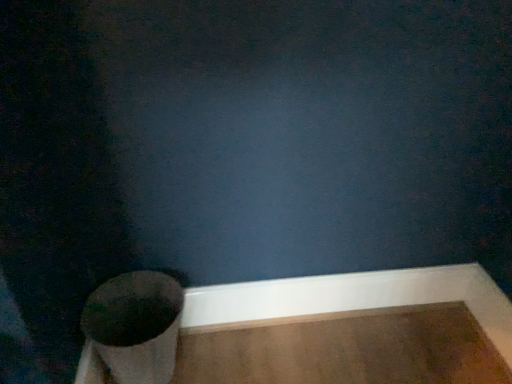
Identify the location of free spot above white smooth baseboard at lower right (from a real-world perspective). The image size is (512, 384). (314, 277).